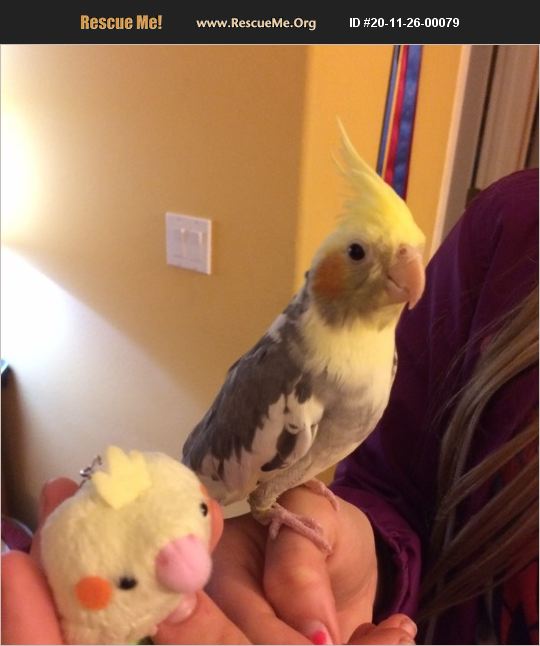
Find the location of a particular element. This screenshot has width=540, height=646. toy is located at coordinates click(x=137, y=548), click(x=388, y=196).